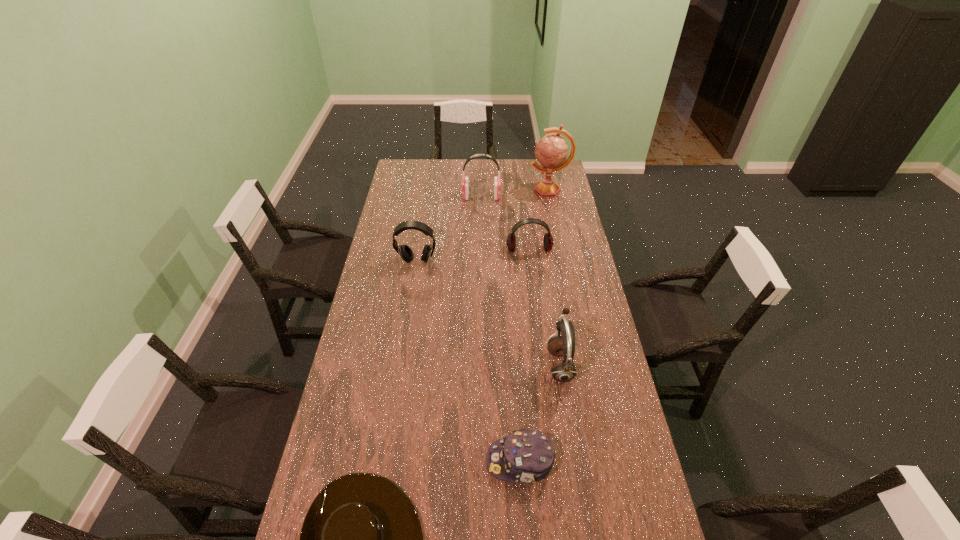
Identify the location of free space between the third earphone from right to left and the nearest earphone. (520, 281).

You are a GUI agent. You are given a task and a screenshot of the screen. Output one action in this format:
    pyautogui.click(x=<x>, y=<y>)
    Task: Click on the free spot between the fifth farthest object and the third shortest object
    This screenshot has height=540, width=960.
    Given the screenshot: What is the action you would take?
    pyautogui.click(x=544, y=307)

You are a GUI agent. You are given a task and a screenshot of the screen. Output one action in this format:
    pyautogui.click(x=<x>, y=<y>)
    Task: Click on the free space between the fifth tallest object and the leftmost earphone
    The width and height of the screenshot is (960, 540).
    Given the screenshot: What is the action you would take?
    point(473,255)

The width and height of the screenshot is (960, 540). In order to click on free space between the shortest earphone and the fifth farthest object in this screenshot , I will do `click(544, 307)`.

The width and height of the screenshot is (960, 540). I want to click on vacant space that's between the fifth farthest object and the globe, so 554,278.

Identify which object is located as the sixth nearest to the leftmost earphone. Please provide its 2D coordinates. Your answer should be formatted as a tuple, i.e. [(x, y)], where the tuple contains the x and y coordinates of a point satisfying the conditions above.

[(361, 539)]

At what (x,y) coordinates should I click in order to perform the action: click on the closest object relative to the farthest earphone. Please return your answer as a coordinate pair (x, y). The width and height of the screenshot is (960, 540). Looking at the image, I should click on (551, 151).

Locate which earphone ranks second in proximity to the farthest earphone. Please provide its 2D coordinates. Your answer should be formatted as a tuple, i.e. [(x, y)], where the tuple contains the x and y coordinates of a point satisfying the conditions above.

[(405, 252)]

The height and width of the screenshot is (540, 960). In order to click on earphone that is the second closest to the headwear in this screenshot , I will do `click(405, 252)`.

Where is `free space in the image that satisfies the following two spatial constraints: 1. on the front-facing side of the tallest object; 2. on the ear cups of the leftmost earphone`? Image resolution: width=960 pixels, height=540 pixels. free space in the image that satisfies the following two spatial constraints: 1. on the front-facing side of the tallest object; 2. on the ear cups of the leftmost earphone is located at coordinates (564, 261).